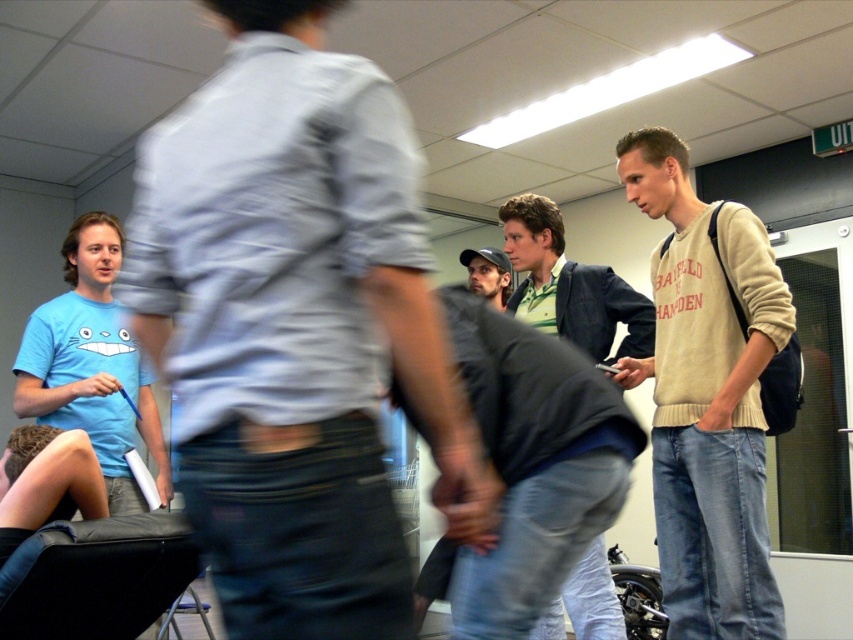
You are standing in the room and want to determine which of the two points, point [662,163] or point [497,257], is nearer to you. Based on the scene description, which point is closer?

Point [662,163] is closer to the camera than point [497,257], so it is the nearer point.

You are organizing a small event and need to move the black leather chair at lower left closer to the beige sweater at right. Based on the scene description, can you determine if moving the chair will block the path to the door on the right?

The black leather chair at lower left is behind the beige sweater at right, so moving it closer might block the path to the door on the right depending on the space available.